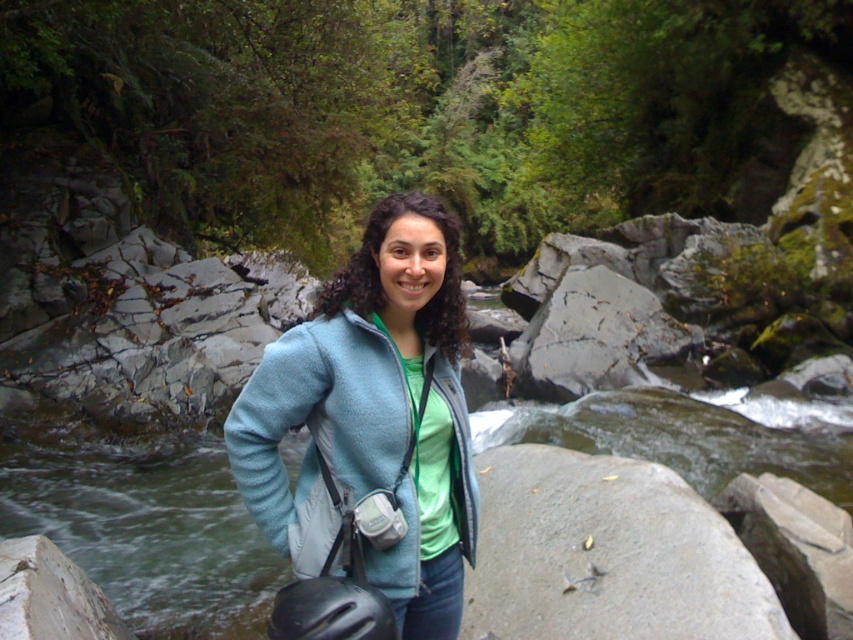
Is point (502, 628) positioned before point (68, 596)?

Yes, point (502, 628) is in front of point (68, 596).

Does gray smooth rock at center appear under gray smooth rock at lower left?

No, gray smooth rock at center is not below gray smooth rock at lower left.

Does point (612, 580) come in front of point (90, 596)?

Yes, it is.

Where is `gray smooth rock at center`? gray smooth rock at center is located at coordinates (606, 554).

Can you confirm if gray smooth rock at center is bigger than light blue fleece jacket at center?

Indeed, gray smooth rock at center has a larger size compared to light blue fleece jacket at center.

What do you see at coordinates (606, 554) in the screenshot? I see `gray smooth rock at center` at bounding box center [606, 554].

At what (x,y) coordinates should I click in order to perform the action: click on gray smooth rock at center. Please return your answer as a coordinate pair (x, y). The width and height of the screenshot is (853, 640). Looking at the image, I should click on (606, 554).

Who is positioned more to the right, light blue fleece jacket at center or gray smooth rock at lower left?

Positioned to the right is light blue fleece jacket at center.

Between light blue fleece jacket at center and gray smooth rock at lower left, which one is positioned higher?

light blue fleece jacket at center is above.

What do you see at coordinates (328, 442) in the screenshot? This screenshot has height=640, width=853. I see `light blue fleece jacket at center` at bounding box center [328, 442].

I want to click on light blue fleece jacket at center, so click(328, 442).